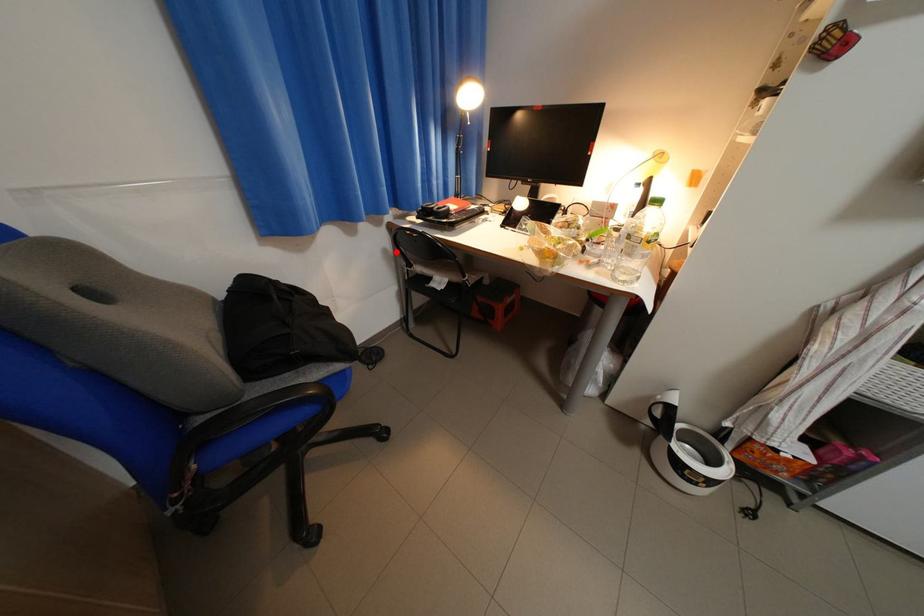
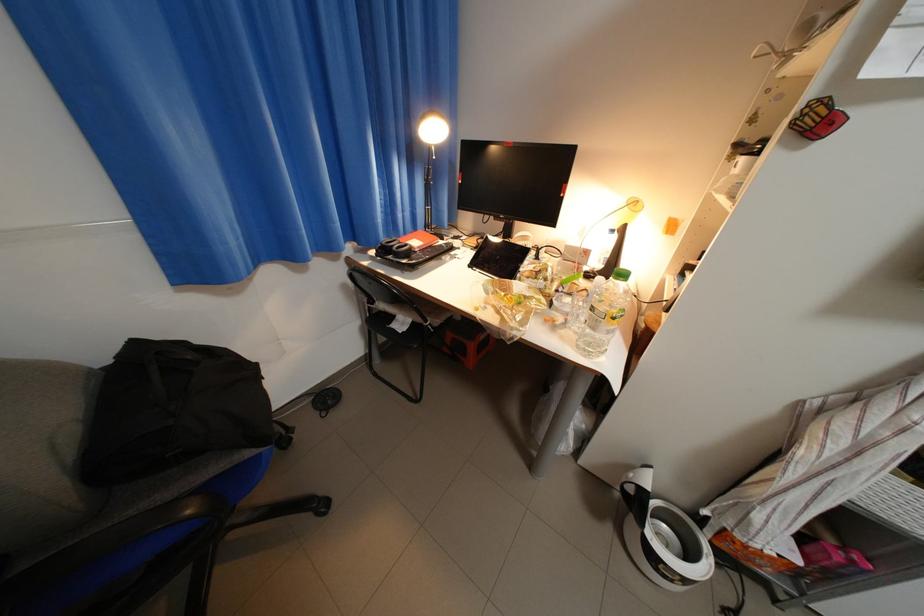
Locate, in the second image, the point that corresponds to the highlighted location in the first image.

(355, 286)